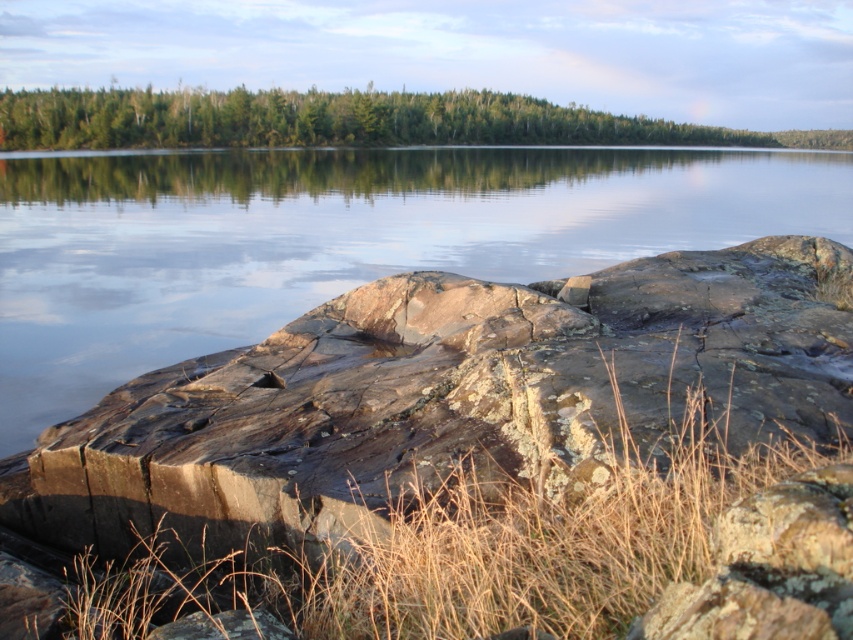
Question: Which of the following is the farthest from the observer?

Choices:
 (A) (155, 104)
 (B) (36, 364)

Answer: (A)

Question: Can you confirm if clear water at center is wider than green matte forest at upper center?

Choices:
 (A) yes
 (B) no

Answer: (B)

Question: Among these objects, which one is nearest to the camera?

Choices:
 (A) green matte forest at upper center
 (B) clear water at center

Answer: (B)

Question: Where is clear water at center located in relation to green matte forest at upper center in the image?

Choices:
 (A) above
 (B) below

Answer: (B)

Question: Does clear water at center appear on the left side of green matte forest at upper center?

Choices:
 (A) no
 (B) yes

Answer: (B)